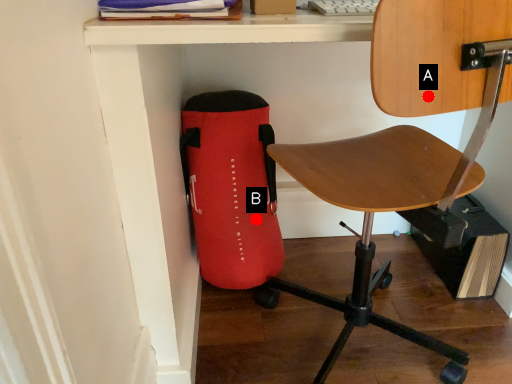
Question: Two points are circled on the image, labeled by A and B beside each circle. Which point is farther from the camera taking this photo?

Choices:
 (A) A is further
 (B) B is further

Answer: (B)